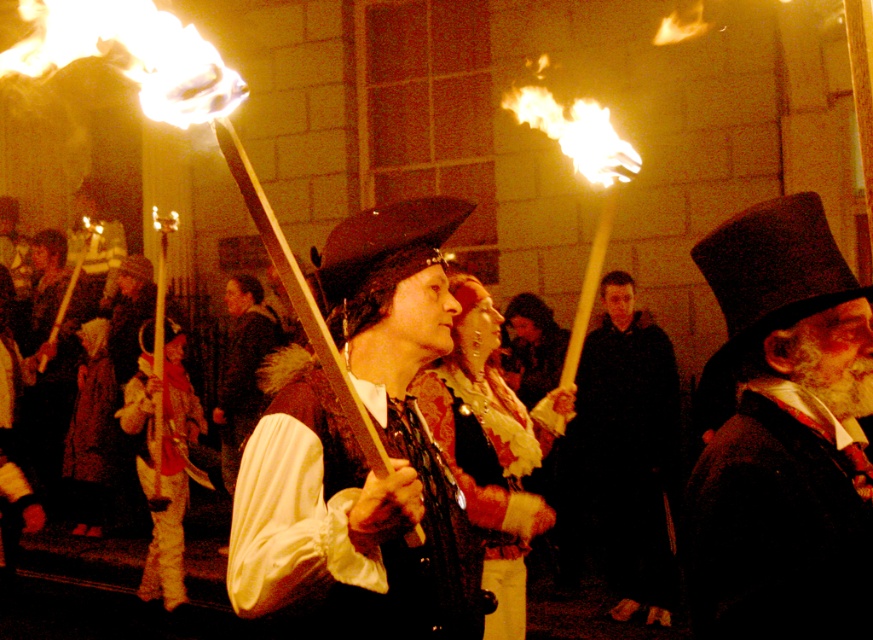
You are standing at point A at point (775, 268). You want to walk to point B, which is 7.95 feet away from you. Is point B closer to the left figure or the center figure?

The distance between point A at point (775, 268) and point B is 7.95 feet. Since the question does not provide specific information about the positions of the left figure or the center figure relative to point A, it is impossible to determine which figure point B is closer to based solely on the given information.

You are a costume designer examining the scene. You need to know if the dark matte coat at center and the velvet red cape at center can be displayed side by side in a 3 meter wide display case. Can they fit?

The dark matte coat at center and velvet red cape at center are 2.72 meters apart, so they can be displayed side by the dark matte coat at center and velvet red cape at center in a 3 meter wide display case since the total width required is less than 3 meters.